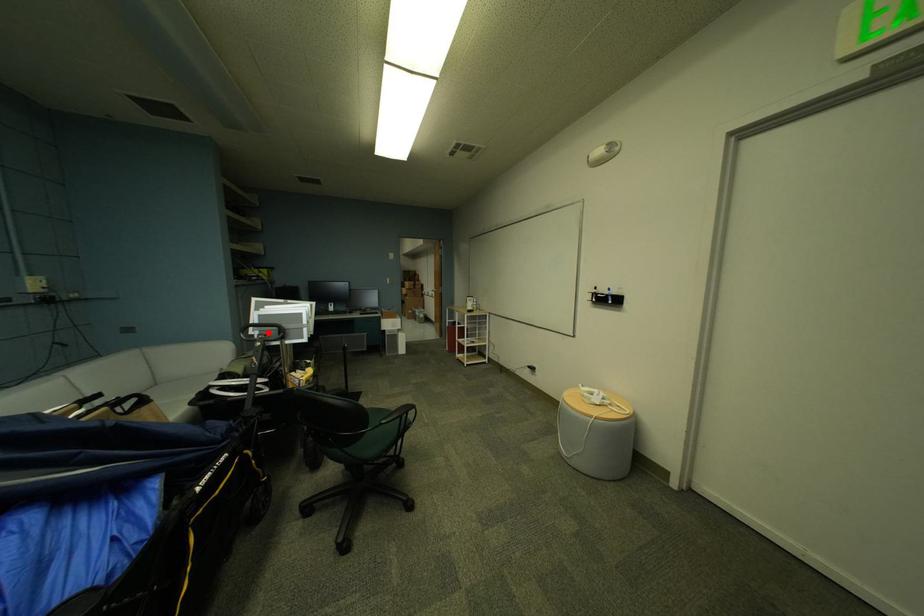
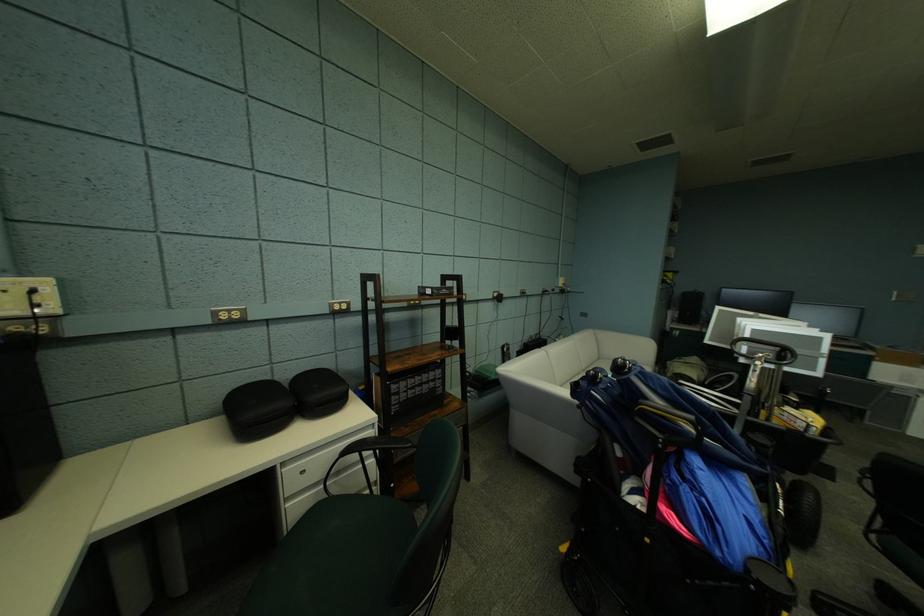
Question: I am providing you with two images of the same scene from different viewpoints. A red point is marked on the first image. Can you still see the location of the red point in image 2?

Choices:
 (A) Yes
 (B) No

Answer: (A)